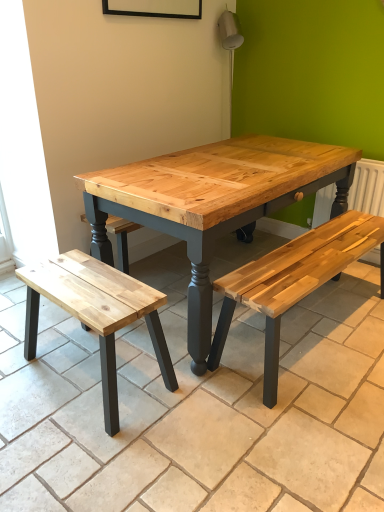
Question: Could you tell me if white painted radiator at right is turned towards natural wood bench at lower left?

Choices:
 (A) no
 (B) yes

Answer: (B)

Question: Can you confirm if white painted radiator at right is smaller than natural wood bench at lower left?

Choices:
 (A) no
 (B) yes

Answer: (B)

Question: Does white painted radiator at right have a lesser width compared to natural wood bench at lower left?

Choices:
 (A) no
 (B) yes

Answer: (B)

Question: Is white painted radiator at right directly adjacent to natural wood bench at lower left?

Choices:
 (A) no
 (B) yes

Answer: (A)

Question: From a real-world perspective, does white painted radiator at right stand above natural wood bench at lower left?

Choices:
 (A) yes
 (B) no

Answer: (A)

Question: From a real-world perspective, is natural wood bench at lower right above or below natural wood bench at lower left?

Choices:
 (A) below
 (B) above

Answer: (A)

Question: Visually, is natural wood bench at lower right positioned to the left or to the right of natural wood bench at lower left?

Choices:
 (A) left
 (B) right

Answer: (B)

Question: Is point (41, 350) positioned closer to the camera than point (74, 287)?

Choices:
 (A) farther
 (B) closer

Answer: (A)

Question: Relative to natural wood bench at lower left, is natural wood bench at lower right in front or behind?

Choices:
 (A) behind
 (B) front

Answer: (B)

Question: From their relative heights in the image, would you say white painted radiator at right is taller or shorter than natural wood bench at lower right?

Choices:
 (A) short
 (B) tall

Answer: (B)

Question: From a real-world perspective, is white painted radiator at right positioned above or below natural wood bench at lower right?

Choices:
 (A) below
 (B) above

Answer: (B)

Question: Relative to natural wood bench at lower right, is white painted radiator at right in front or behind?

Choices:
 (A) front
 (B) behind

Answer: (B)

Question: Considering the positions of white painted radiator at right and natural wood bench at lower right in the image, is white painted radiator at right bigger or smaller than natural wood bench at lower right?

Choices:
 (A) big
 (B) small

Answer: (B)

Question: In terms of height, does white painted radiator at right look taller or shorter compared to natural wood bench at lower left?

Choices:
 (A) tall
 (B) short

Answer: (A)

Question: Is white painted radiator at right wider or thinner than natural wood bench at lower left?

Choices:
 (A) wide
 (B) thin

Answer: (B)